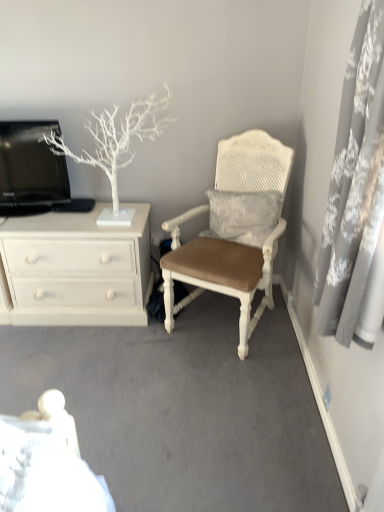
Where is `vacant space that is to the left of white textured cushioned chair at center`? This screenshot has height=512, width=384. vacant space that is to the left of white textured cushioned chair at center is located at coordinates (125, 350).